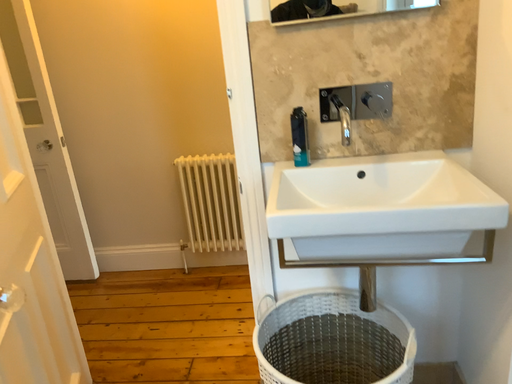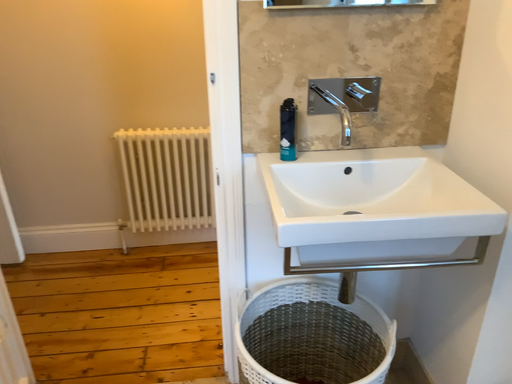
Question: How did the camera likely rotate when shooting the video?

Choices:
 (A) rotated right
 (B) rotated left

Answer: (A)